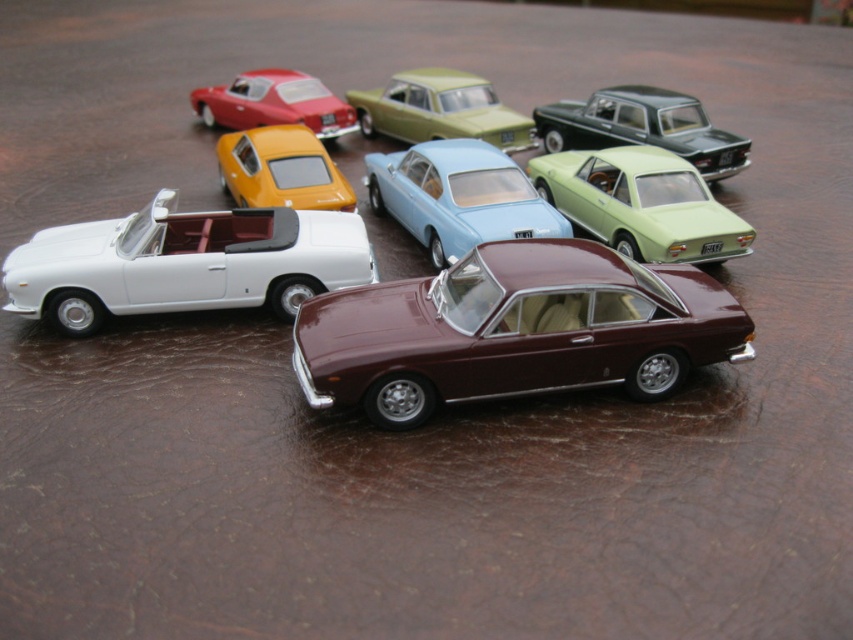
You are a collector of miniature cars and want to place a new blue car between the matte green car at center and the matte red car at upper left. Based on their current positions, where should you place the new blue car to maintain the existing arrangement?

The matte green car at center is positioned on the right side of the matte red car at upper left, so you should place the new blue car between them, aligning it to the right of the matte red car at upper left and to the left of the matte green car at center to maintain the existing arrangement.

You are a delivery drone trying to land on the textured surface between the maroon car in the center and the white matte convertible at left. Can you safely land there without hitting any cars?

The white matte convertible at left is located at point (184, 262), so yes, there is space between the maroon car in the center and the white matte convertible at left for the drone to land safely.